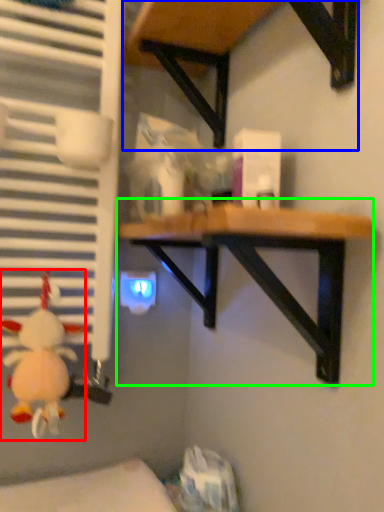
Question: Considering the real-world distances, which object is farthest from toy (highlighted by a red box)? table (highlighted by a blue box) or table (highlighted by a green box)?

Choices:
 (A) table
 (B) table

Answer: (A)